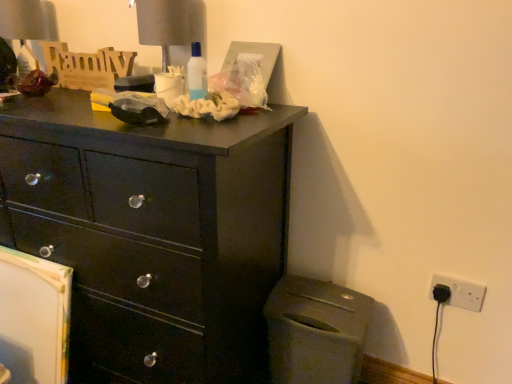
Question: Considering the positions of matte gray trash can at lower right and white plastic electric outlet at lower right in the image, is matte gray trash can at lower right wider or thinner than white plastic electric outlet at lower right?

Choices:
 (A) wide
 (B) thin

Answer: (A)

Question: Is matte gray trash can at lower right in front of or behind white plastic electric outlet at lower right in the image?

Choices:
 (A) front
 (B) behind

Answer: (A)

Question: Which object is positioned farthest from the white plastic electric outlet at lower right?

Choices:
 (A) matte gray table lamp at upper left, the second table lamp positioned from the right
 (B) matte black dresser at upper left
 (C) matte gray table lamp at upper center, marked as the first table lamp in a right-to-left arrangement
 (D) matte gray trash can at lower right

Answer: (A)

Question: Which object is positioned farthest from the matte black dresser at upper left?

Choices:
 (A) matte gray table lamp at upper left, placed as the 1th table lamp when sorted from left to right
 (B) white plastic electric outlet at lower right
 (C) matte gray trash can at lower right
 (D) matte gray table lamp at upper center, which ranks as the first table lamp in front-to-back order

Answer: (B)